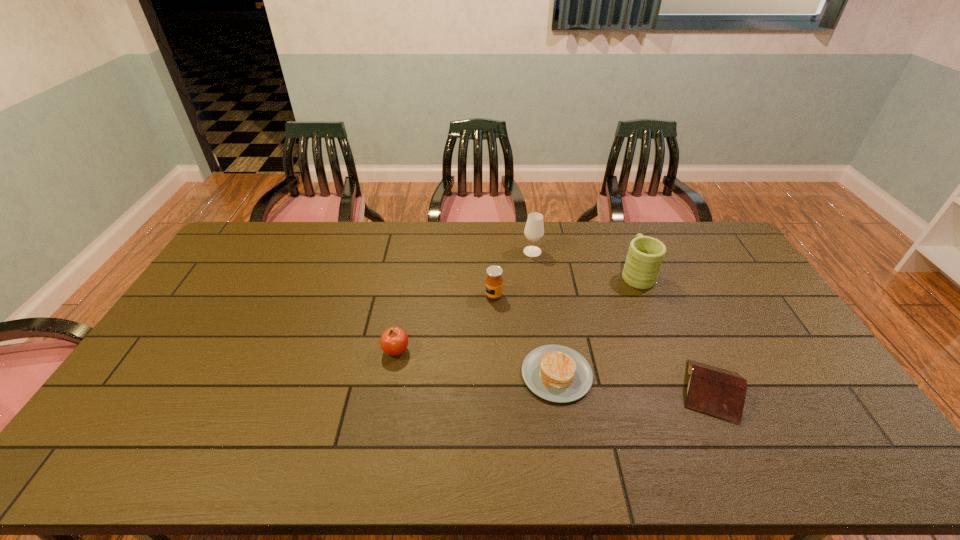
The height and width of the screenshot is (540, 960). Find the location of `vacant area at the left edge of the desktop`. vacant area at the left edge of the desktop is located at coordinates (223, 269).

In the image, there is a desktop. At what (x,y) coordinates should I click in order to perform the action: click on vacant space at the far left corner. Please return your answer as a coordinate pair (x, y). This screenshot has width=960, height=540. Looking at the image, I should click on (261, 226).

At what (x,y) coordinates should I click in order to perform the action: click on free space at the far right corner. Please return your answer as a coordinate pair (x, y). Image resolution: width=960 pixels, height=540 pixels. Looking at the image, I should click on (706, 258).

The image size is (960, 540). I want to click on empty space that is in between the leftmost object and the mug, so click(516, 312).

In order to click on free space between the shortest object and the book in this screenshot , I will do `click(635, 382)`.

You are a GUI agent. You are given a task and a screenshot of the screen. Output one action in this format:
    pyautogui.click(x=<x>, y=<y>)
    Task: Click on the empty space between the glass and the honey
    
    Given the screenshot: What is the action you would take?
    pyautogui.click(x=513, y=273)

Locate an element on the screen. This screenshot has width=960, height=540. vacant area that lies between the second shortest object and the fifth object from right to left is located at coordinates (603, 343).

Locate an element on the screen. The height and width of the screenshot is (540, 960). vacant space in between the mug and the book is located at coordinates (674, 332).

I want to click on vacant area that lies between the honey and the mug, so [x=565, y=285].

At what (x,y) coordinates should I click in order to perform the action: click on free spot between the glass and the apple. Please return your answer as a coordinate pair (x, y). This screenshot has height=540, width=960. Looking at the image, I should click on (465, 301).